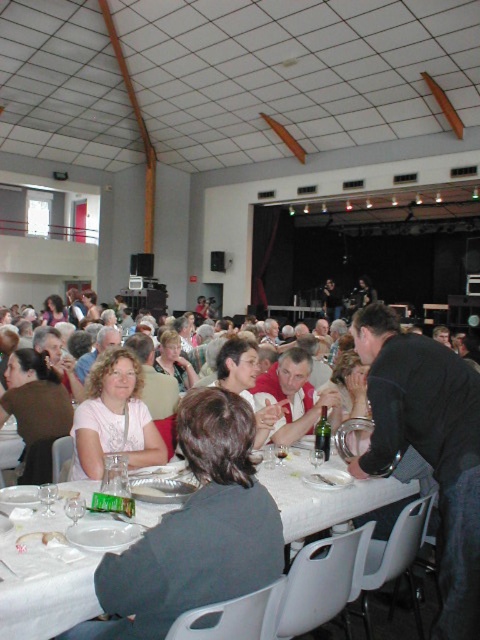
Question: Which point is closer to the camera taking this photo?

Choices:
 (A) (90, 417)
 (B) (14, 627)
 (C) (163, 557)

Answer: (C)

Question: Does white fabric shirt at center have a larger size compared to matte pink shirt at center?

Choices:
 (A) no
 (B) yes

Answer: (B)

Question: Does white fabric shirt at center come behind matte pink shirt at center?

Choices:
 (A) no
 (B) yes

Answer: (A)

Question: Which point appears farthest from the camera in this image?

Choices:
 (A) (199, 444)
 (B) (135, 429)

Answer: (B)

Question: Among these objects, which one is nearest to the camera?

Choices:
 (A) white plastic table at lower center
 (B) white fabric shirt at center

Answer: (B)

Question: Does white fabric shirt at center come in front of white plastic table at lower center?

Choices:
 (A) no
 (B) yes

Answer: (B)